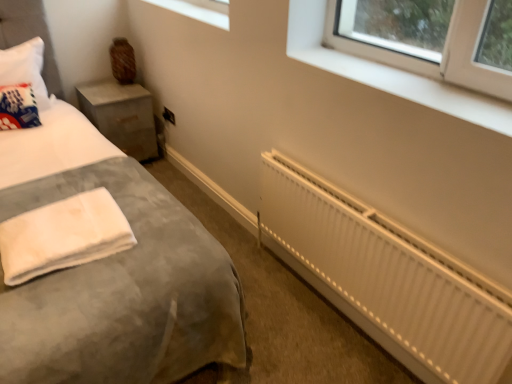
Find the location of a particular element. The image size is (512, 384). vacant space to the left of white metallic radiator at lower right is located at coordinates (278, 317).